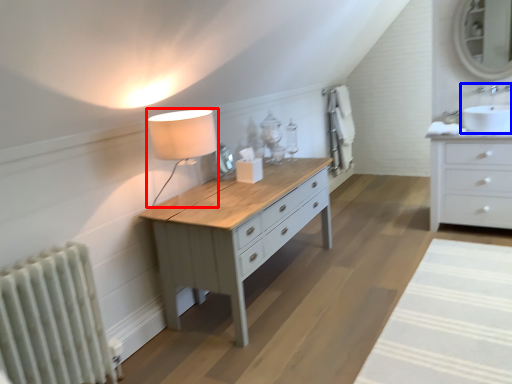
Question: Which point is closer to the camera, table lamp (highlighted by a red box) or sink (highlighted by a blue box)?

Choices:
 (A) table lamp
 (B) sink

Answer: (A)